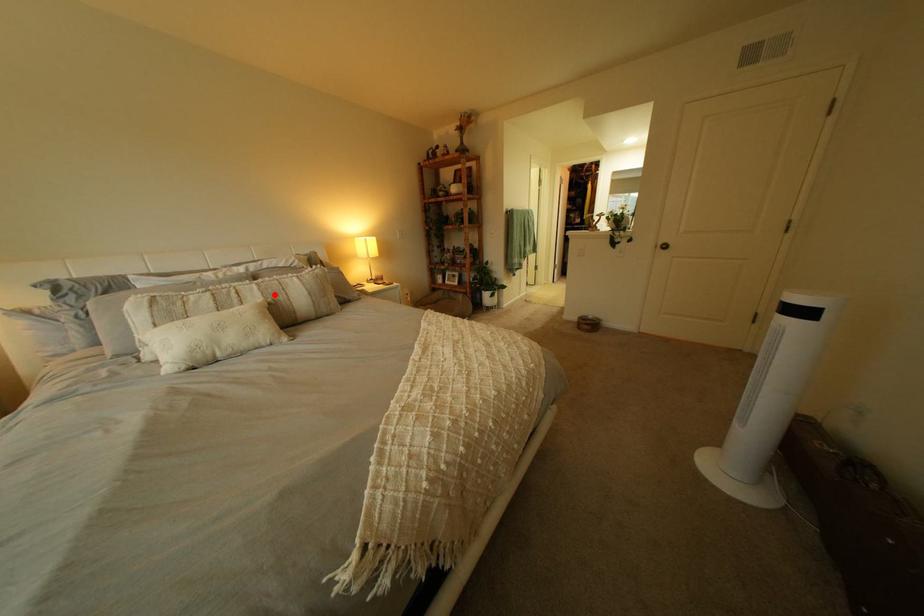
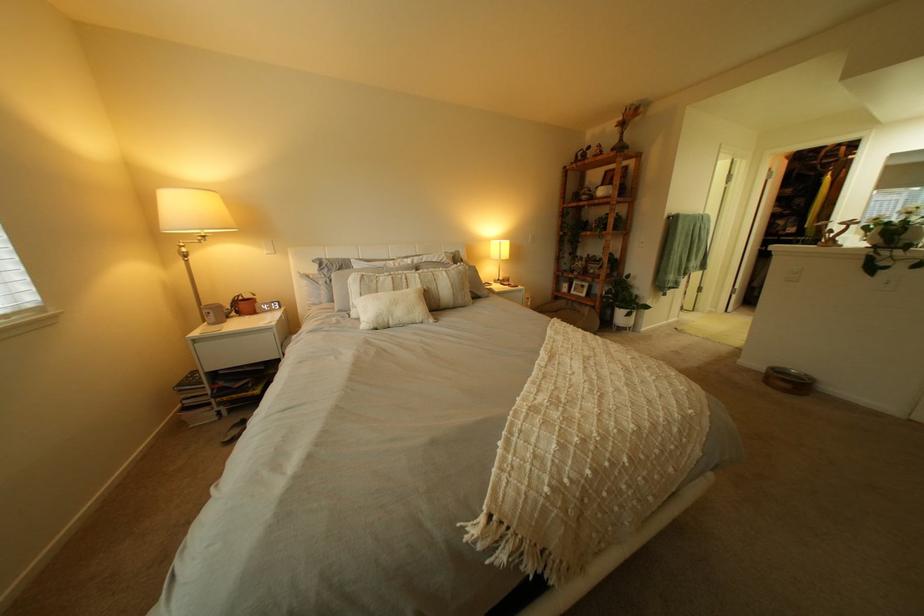
Where in the second image is the point corresponding to the highlighted location from the first image?

(434, 283)